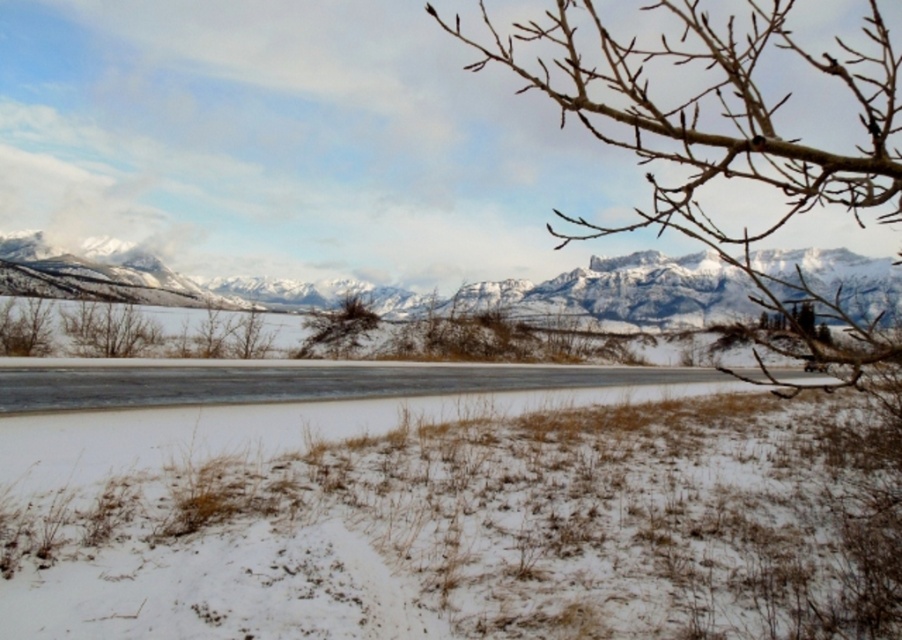
Question: Is white snow at center above snowy granite mountains at center?

Choices:
 (A) yes
 (B) no

Answer: (B)

Question: Is snowy granite mountains at center positioned behind smooth ice at center?

Choices:
 (A) yes
 (B) no

Answer: (A)

Question: Which object is the closest to the white snow at center?

Choices:
 (A) smooth ice at center
 (B) brown textured bush at center
 (C) snowy granite mountains at center

Answer: (A)

Question: Estimate the real-world distances between objects in this image. Which object is farther from the brown textured bush at center?

Choices:
 (A) brown leafless branch at lower left
 (B) smooth ice at center
 (C) snowy granite mountains at center

Answer: (C)

Question: In this image, where is white snow at center located relative to snowy granite mountains at center?

Choices:
 (A) right
 (B) left

Answer: (A)

Question: Which object is closer to the camera taking this photo?

Choices:
 (A) snowy granite mountains at center
 (B) brown textured bush at center
 (C) white snow at center

Answer: (C)